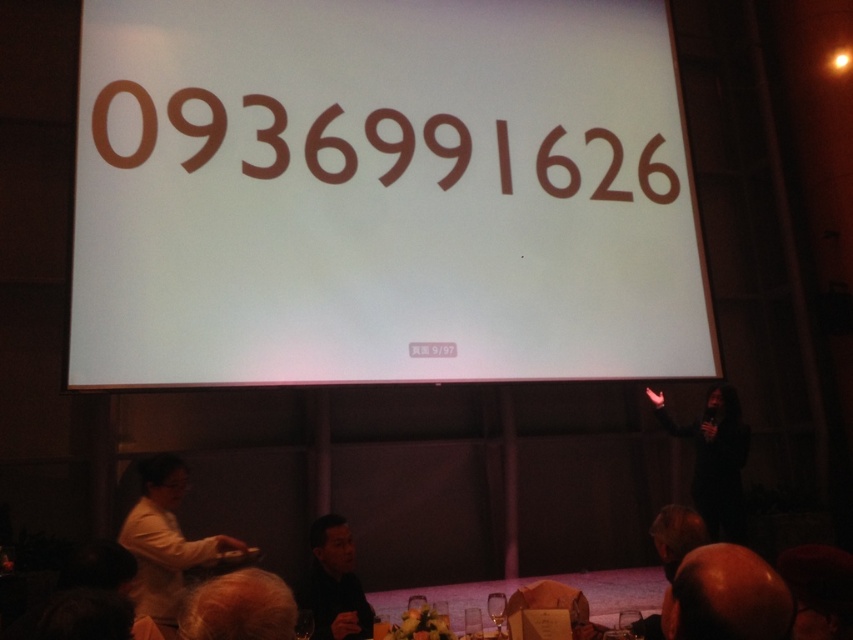
Is point (186, 227) behind point (712, 580)?

Yes, it is.

Between brown matte text at center and smooth brown head at lower right, which one is positioned higher?

brown matte text at center is higher up.

The height and width of the screenshot is (640, 853). What are the coordinates of `brown matte text at center` in the screenshot? It's located at (381, 193).

Image resolution: width=853 pixels, height=640 pixels. In order to click on brown matte text at center in this screenshot , I will do `click(381, 193)`.

In order to click on brown matte text at center in this screenshot , I will do `click(381, 193)`.

Is brown matte text at center above dark gray shirt at lower center?

Yes, brown matte text at center is above dark gray shirt at lower center.

Find the location of a particular element. The image size is (853, 640). brown matte text at center is located at coordinates (381, 193).

Can you confirm if smooth brown head at lower right is smaller than light brown hair at lower left?

Actually, smooth brown head at lower right might be larger than light brown hair at lower left.

Who is positioned more to the right, smooth brown head at lower right or light brown hair at lower left?

Positioned to the right is smooth brown head at lower right.

Describe the element at coordinates (724, 596) in the screenshot. I see `smooth brown head at lower right` at that location.

Where is `smooth brown head at lower right`? Image resolution: width=853 pixels, height=640 pixels. smooth brown head at lower right is located at coordinates (724, 596).